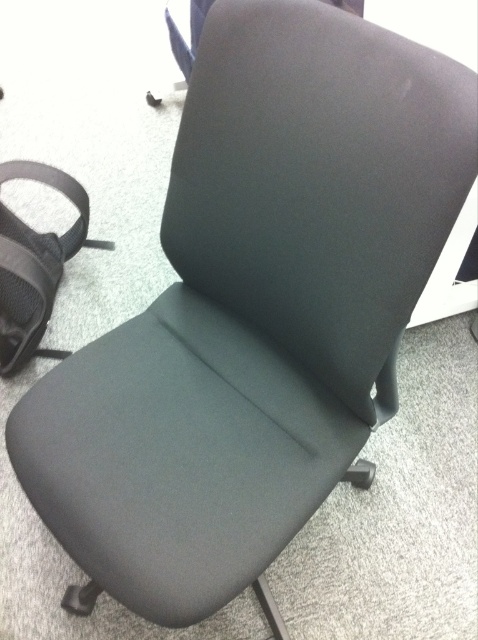
Can you confirm if dark gray fabric chair at center is positioned to the left of black mesh strap at left?

Incorrect, dark gray fabric chair at center is not on the left side of black mesh strap at left.

Which of these two, dark gray fabric chair at center or black mesh strap at left, stands taller?

dark gray fabric chair at center is taller.

Does point (242, 13) lie in front of point (0, 358)?

Yes.

Identify the location of dark gray fabric chair at center. This screenshot has width=478, height=640. (318, 180).